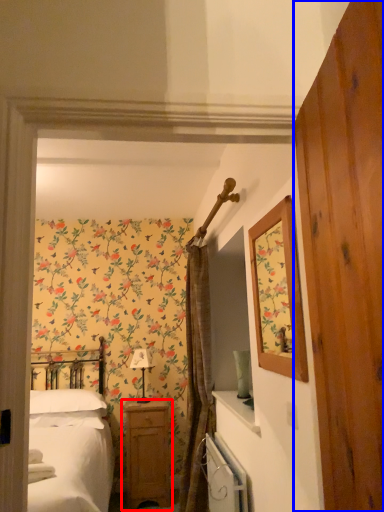
Question: Which point is closer to the camera, nightstand (highlighted by a red box) or barn door (highlighted by a blue box)?

Choices:
 (A) nightstand
 (B) barn door

Answer: (B)